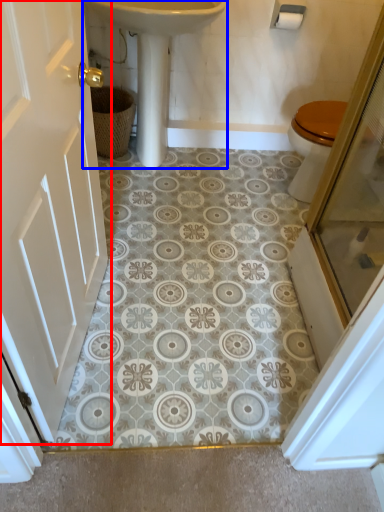
Question: Which object is further to the camera taking this photo, door (highlighted by a red box) or sink (highlighted by a blue box)?

Choices:
 (A) door
 (B) sink

Answer: (B)